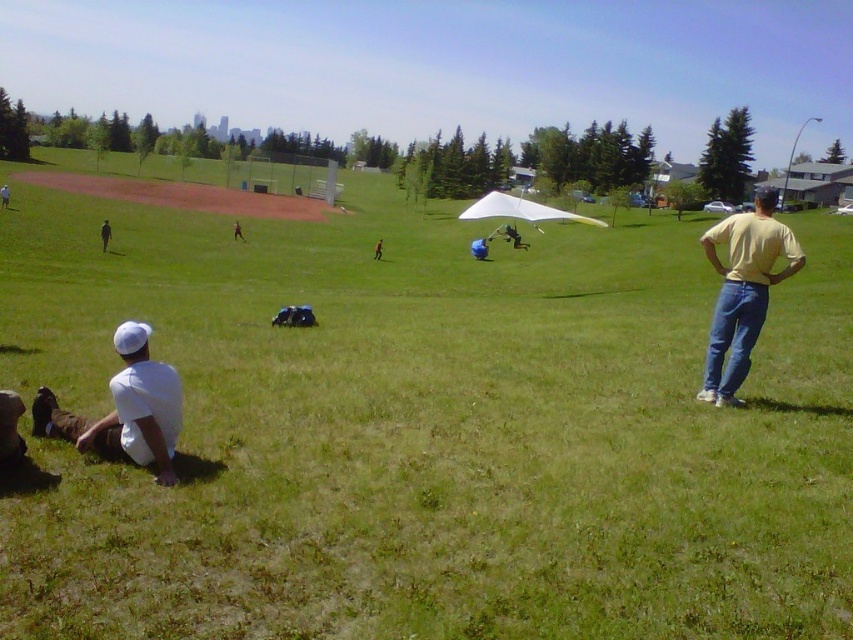
Between black fabric person at left and light brown fabric jacket at center, which one appears on the right side from the viewer's perspective?

From the viewer's perspective, light brown fabric jacket at center appears more on the right side.

Does point (103, 232) come behind point (241, 236)?

No, it is not.

At what (x,y) coordinates should I click in order to perform the action: click on black fabric person at left. Please return your answer as a coordinate pair (x, y). Looking at the image, I should click on (105, 234).

Who is positioned more to the right, yellow matte shirt at right or white matte shirt at lower left?

yellow matte shirt at right is more to the right.

Is yellow matte shirt at right in front of white matte shirt at lower left?

No, yellow matte shirt at right is behind white matte shirt at lower left.

The image size is (853, 640). In order to click on yellow matte shirt at right in this screenshot , I will do `click(743, 291)`.

Between white cotton shirt at lower left and light brown fabric jacket at center, which one appears on the right side from the viewer's perspective?

From the viewer's perspective, light brown fabric jacket at center appears more on the right side.

Does point (3, 188) lie behind point (236, 232)?

Yes, it is.

Between point (4, 204) and point (236, 230), which one is positioned in front?

Point (236, 230) is more forward.

The width and height of the screenshot is (853, 640). I want to click on white cotton shirt at lower left, so click(4, 195).